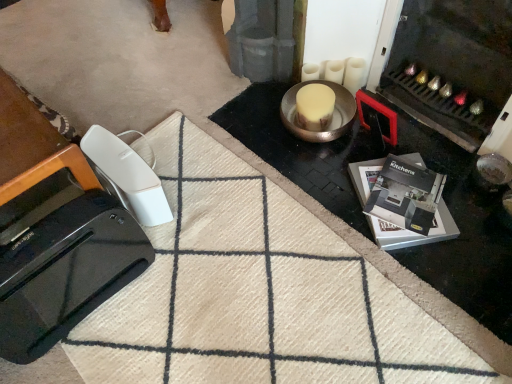
In order to click on vacant space in front of white plastic remote at lower left, marked as the second home appliance in a front-to-back arrangement in this screenshot , I will do `click(144, 255)`.